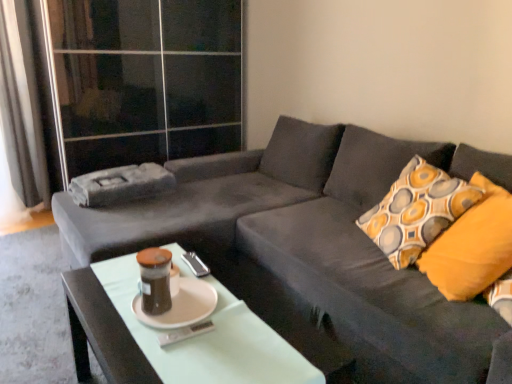
Question: Is white glossy coffee table at center to the right of patterned fabric pillow at right from the viewer's perspective?

Choices:
 (A) yes
 (B) no

Answer: (B)

Question: Is the depth of white glossy coffee table at center greater than that of patterned fabric pillow at right?

Choices:
 (A) no
 (B) yes

Answer: (A)

Question: Is white glossy coffee table at center touching patterned fabric pillow at right?

Choices:
 (A) no
 (B) yes

Answer: (A)

Question: Does white glossy coffee table at center have a larger size compared to patterned fabric pillow at right?

Choices:
 (A) yes
 (B) no

Answer: (B)

Question: Considering the relative positions of white glossy coffee table at center and patterned fabric pillow at right in the image provided, is white glossy coffee table at center to the left of patterned fabric pillow at right from the viewer's perspective?

Choices:
 (A) no
 (B) yes

Answer: (B)

Question: Considering the positions of patterned fabric pillow at right and white matte saucer at center in the image, is patterned fabric pillow at right wider or thinner than white matte saucer at center?

Choices:
 (A) thin
 (B) wide

Answer: (B)

Question: Considering the positions of patterned fabric pillow at right and white matte saucer at center in the image, is patterned fabric pillow at right taller or shorter than white matte saucer at center?

Choices:
 (A) tall
 (B) short

Answer: (A)

Question: In terms of size, does patterned fabric pillow at right appear bigger or smaller than white matte saucer at center?

Choices:
 (A) small
 (B) big

Answer: (B)

Question: Is patterned fabric pillow at right inside or outside of white matte saucer at center?

Choices:
 (A) outside
 (B) inside

Answer: (A)

Question: Is white glossy coffee table at center inside the boundaries of gray fabric curtain at left, or outside?

Choices:
 (A) inside
 (B) outside

Answer: (B)

Question: From their relative heights in the image, would you say white glossy coffee table at center is taller or shorter than gray fabric curtain at left?

Choices:
 (A) short
 (B) tall

Answer: (A)

Question: Is white glossy coffee table at center bigger or smaller than gray fabric curtain at left?

Choices:
 (A) big
 (B) small

Answer: (B)

Question: In terms of width, does white glossy coffee table at center look wider or thinner when compared to gray fabric curtain at left?

Choices:
 (A) thin
 (B) wide

Answer: (A)

Question: From the image's perspective, is velvet dark gray couch at center located above or below teal glass jar at center?

Choices:
 (A) above
 (B) below

Answer: (A)

Question: From their relative heights in the image, would you say velvet dark gray couch at center is taller or shorter than teal glass jar at center?

Choices:
 (A) tall
 (B) short

Answer: (A)